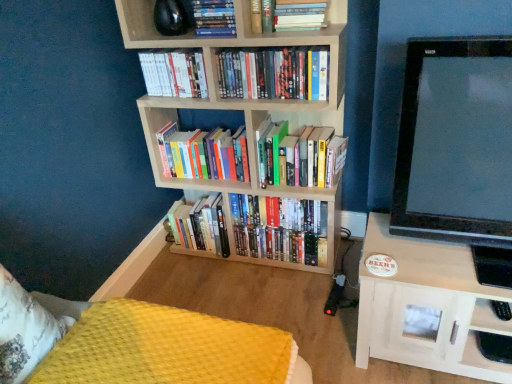
Find the location of a particular element. Image resolution: width=512 pixels, height=384 pixels. free space below black glossy tv at right (from a real-world perspective) is located at coordinates (446, 267).